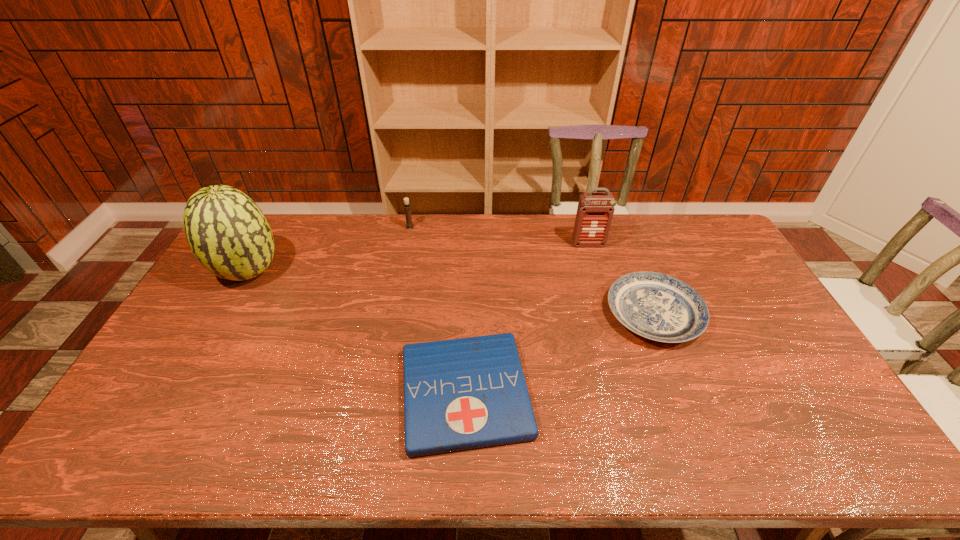
Where is `vacant space located 0.330m on the front-facing side of the second farthest object`? This screenshot has width=960, height=540. vacant space located 0.330m on the front-facing side of the second farthest object is located at coordinates (609, 315).

Locate an element on the screen. This screenshot has width=960, height=540. blank area located on the right of the farthest object is located at coordinates (463, 227).

Image resolution: width=960 pixels, height=540 pixels. Identify the location of free point located 0.340m on the left of the second shortest object. (497, 314).

Where is `vacant space located on the back of the nearer first-aid kit`? vacant space located on the back of the nearer first-aid kit is located at coordinates (468, 312).

Where is `watermelon that is positioned at the far edge`? Image resolution: width=960 pixels, height=540 pixels. watermelon that is positioned at the far edge is located at coordinates (227, 232).

Locate an element on the screen. The width and height of the screenshot is (960, 540). the first-aid kit present at the far edge is located at coordinates (595, 210).

The height and width of the screenshot is (540, 960). Identify the location of candle holder at the far edge. (409, 225).

In order to click on object positioned at the near edge in this screenshot , I will do `click(459, 394)`.

The height and width of the screenshot is (540, 960). I want to click on object located at the left edge, so click(227, 232).

The width and height of the screenshot is (960, 540). I want to click on object at the far left corner, so click(227, 232).